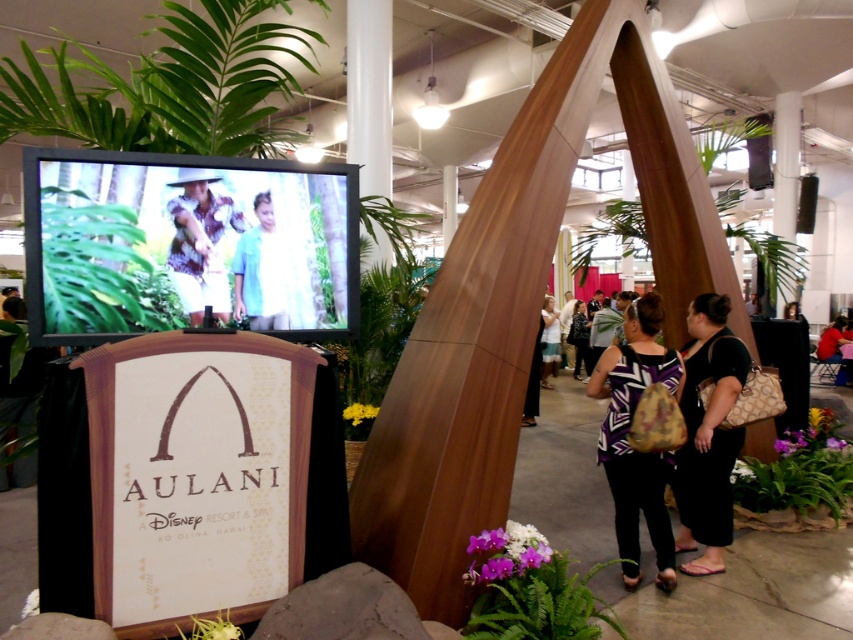
The image size is (853, 640). What do you see at coordinates (200, 244) in the screenshot?
I see `patterned fabric dress at center` at bounding box center [200, 244].

Does point (209, 204) come in front of point (181, 634)?

No, (209, 204) is further to viewer.

Is point (199, 172) farther from camera compared to point (206, 636)?

Yes, it is behind point (206, 636).

Find the location of a particular element. patterned fabric dress at center is located at coordinates (200, 244).

Identify the location of red shirt at right. (836, 348).

Does red shirt at right have a larger size compared to light blue denim shorts at center?

Yes.

Is point (827, 352) positioned behind point (558, 353)?

No, (827, 352) is in front of (558, 353).

In order to click on red shirt at right in this screenshot , I will do `click(836, 348)`.

Looking at this image, is purple glossy orchid at lower center to the right of patterned fabric dress at center from the viewer's perspective?

Correct, you'll find purple glossy orchid at lower center to the right of patterned fabric dress at center.

Is point (476, 632) farther from viewer compared to point (177, 289)?

That is True.

Locate an element on the screen. Image resolution: width=853 pixels, height=640 pixels. purple glossy orchid at lower center is located at coordinates (531, 589).